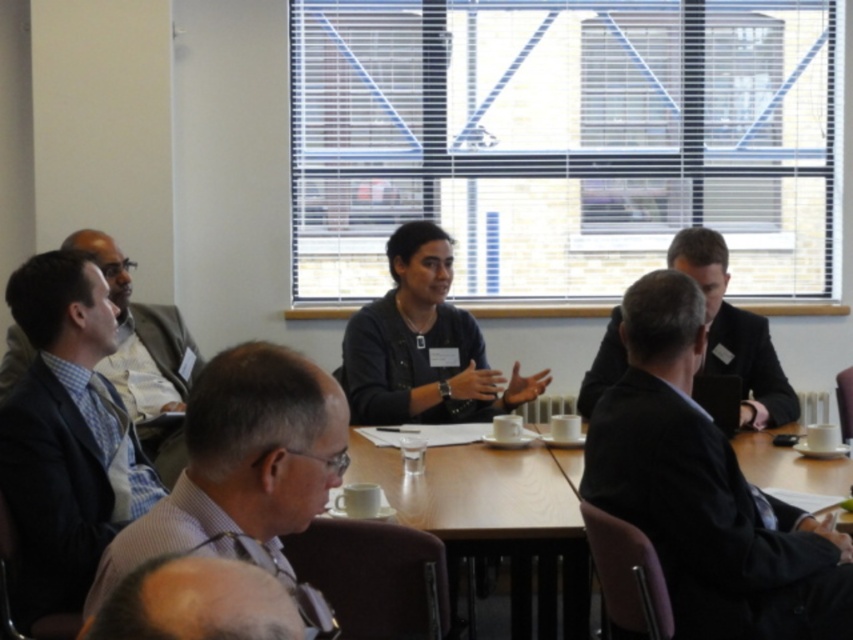
You are a service robot in the meeting room. You need to deliver a document to the person wearing the gray fabric shirt at lower center. The robot has a maximum reach of 5 feet. Can you reach them from your current position next to the dark blue suit at left without moving?

The dark blue suit at left is 4.95 feet away from the gray fabric shirt at lower center. Since the robot can reach up to 5 feet, it can just barely reach the gray fabric shirt at lower center from its position next to the dark blue suit at left.

You are a photographer taking a group photo of the meeting participants. You need to ensure that the dark blue suit at left and the gray fabric shirt at lower center are both visible in the frame. Given their height difference, which one might you need to position closer to the camera to keep both in focus?

The dark blue suit at left has a greater height compared to gray fabric shirt at lower center. To keep both in focus, position the gray fabric shirt at lower center slightly closer to the camera so that their heights appear balanced in the photo.

You are a server who needs to deliver a tray of snacks to the meeting room. The tray is 12 inches wide. You see the wooden table at center and the black suit at center. Can you place the tray between them without moving either object?

Result: The wooden table at center is 34.26 inches away from the black suit at center. Since the tray is only 12 inches wide, there is enough space between them to place the tray without moving either object.